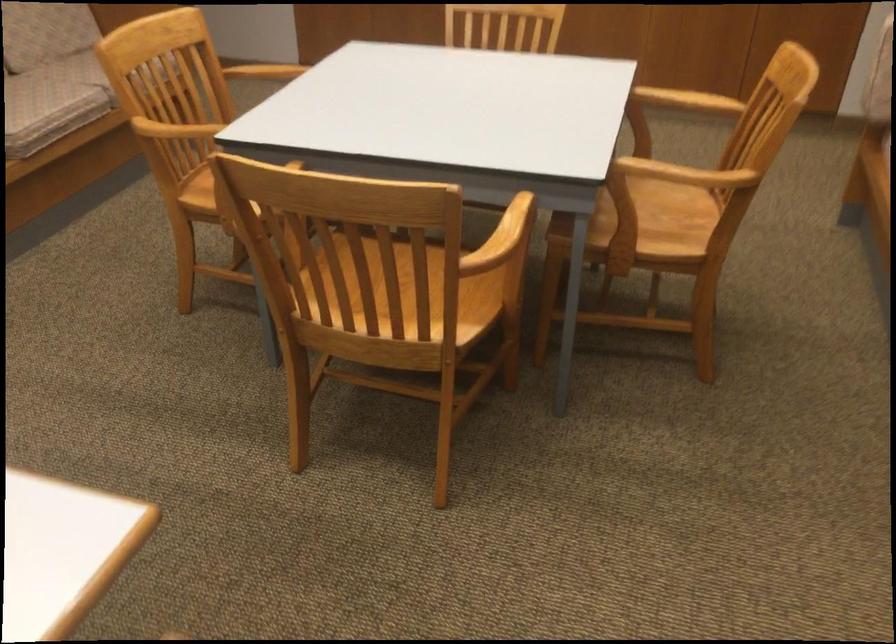
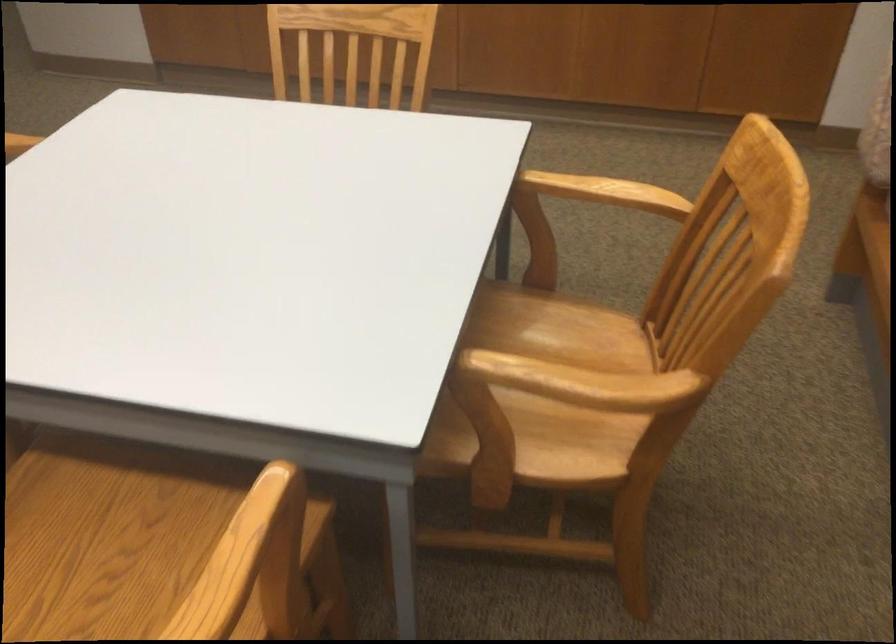
Question: Based on the continuous images, in which direction is the camera rotating? Reply with the corresponding letter.

Choices:
 (A) Left
 (B) Right
 (C) Up
 (D) Down

Answer: (D)